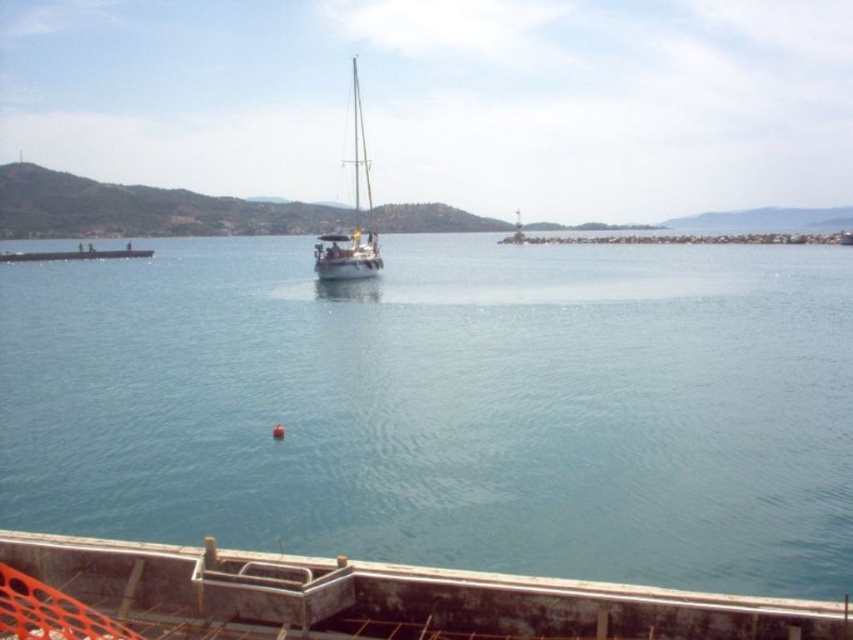
Question: Can you confirm if clear blue water at center is smaller than concrete dock at lower center?

Choices:
 (A) yes
 (B) no

Answer: (B)

Question: Among these objects, which one is nearest to the camera?

Choices:
 (A) white glossy sailboat at center
 (B) concrete dock at lower center
 (C) clear blue water at center

Answer: (B)

Question: Does clear blue water at center appear over white glossy sailboat at center?

Choices:
 (A) yes
 (B) no

Answer: (B)

Question: Considering the real-world distances, which object is farthest from the concrete dock at lower center?

Choices:
 (A) clear blue water at center
 (B) white glossy sailboat at center

Answer: (B)

Question: Which object appears farthest from the camera in this image?

Choices:
 (A) white glossy sailboat at center
 (B) concrete dock at lower center

Answer: (A)

Question: From the image, what is the correct spatial relationship of clear blue water at center in relation to concrete dock at lower center?

Choices:
 (A) above
 (B) below

Answer: (A)